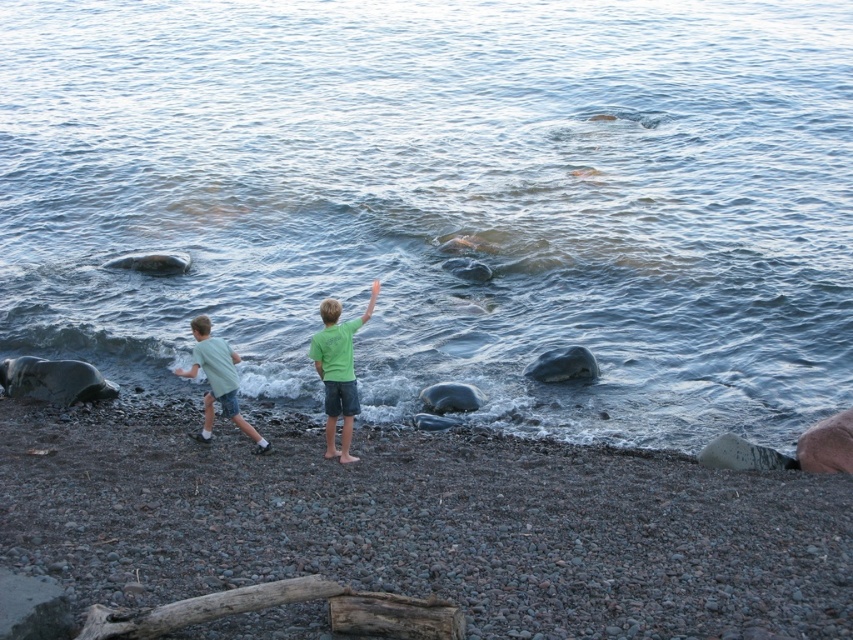
Question: Does smooth pebbles at center appear over green matte shirt at center?

Choices:
 (A) yes
 (B) no

Answer: (B)

Question: Which of the following is the closest to the observer?

Choices:
 (A) (216, 384)
 (B) (329, 305)
 (C) (468, 380)

Answer: (B)

Question: Which object is positioned closest to the smooth pebbles at center?

Choices:
 (A) green matte shirt at center
 (B) clear water at center

Answer: (A)

Question: Does clear water at center appear on the left side of green matte shirt at center?

Choices:
 (A) no
 (B) yes

Answer: (A)

Question: Estimate the real-world distances between objects in this image. Which object is farther from the clear water at center?

Choices:
 (A) smooth pebbles at center
 (B) light green cotton shirt at left
 (C) green matte shirt at center

Answer: (C)

Question: Where is clear water at center located in relation to smooth pebbles at center in the image?

Choices:
 (A) right
 (B) left

Answer: (A)